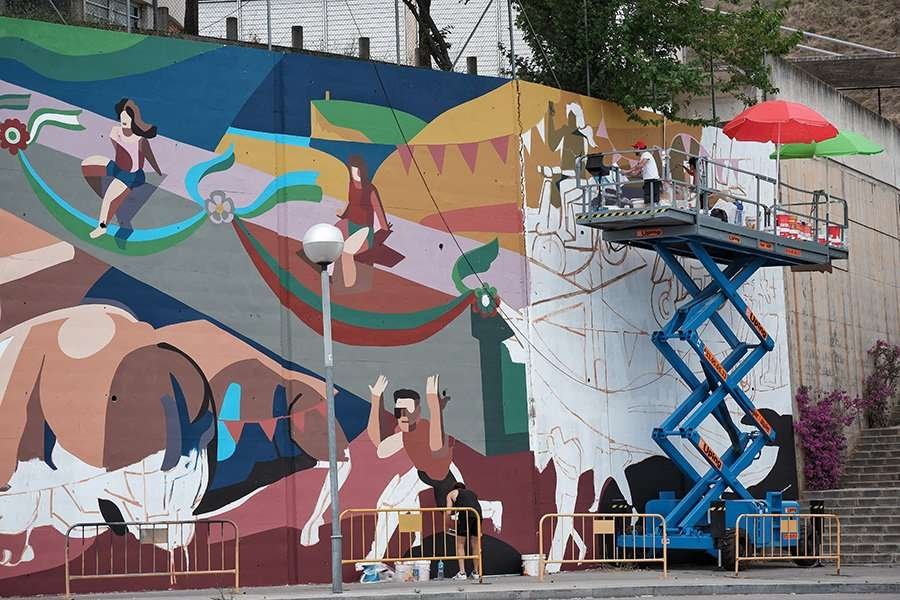
This screenshot has width=900, height=600. Find the location of `pink paint`. pink paint is located at coordinates (13, 570).